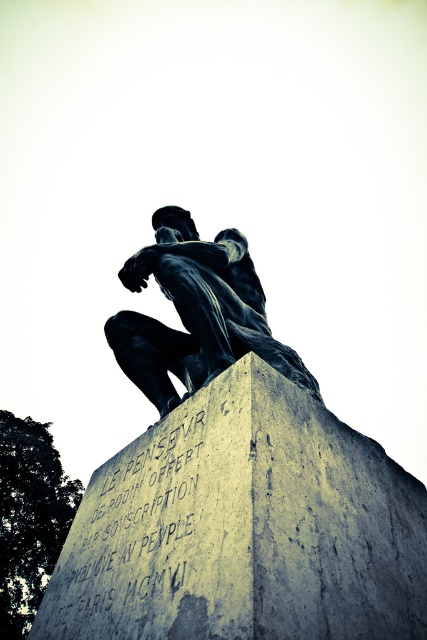
You are an art conservator examining the statue and its pedestal. You notice the gray concrete at center and the bronze statue at center. Which object is located to the left of the other?

The gray concrete at center is positioned on the left side of bronze statue at center.

Looking at this image, you are an art conservator assessing the placement of the bronze statue at center on the gray concrete at center. Based on the scene, is the statue resting on the pedestal or elevated above it?

The bronze statue at center is elevated above the gray concrete at center since it is placed atop the pedestal, which is made of gray concrete at center.